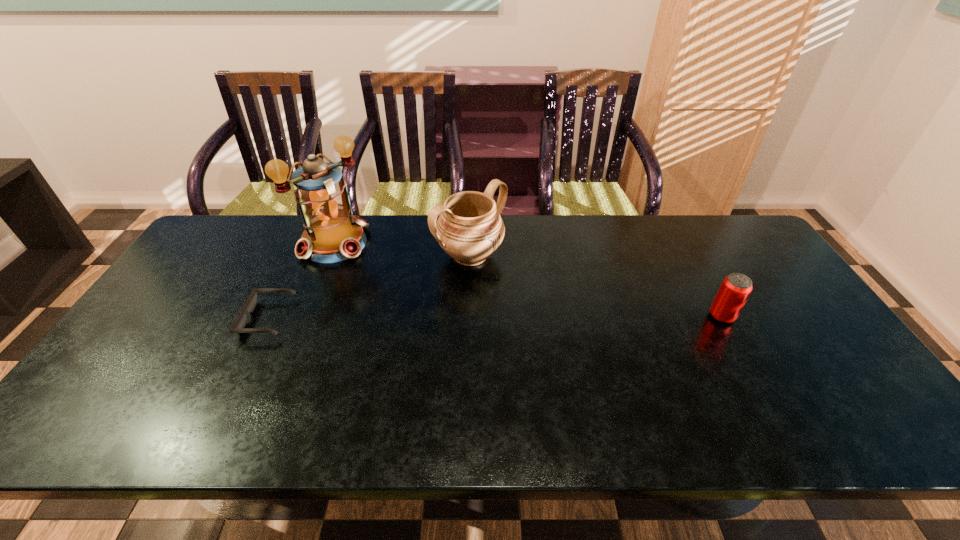
This screenshot has width=960, height=540. Find the location of `free region at the left edge of the desktop`. free region at the left edge of the desktop is located at coordinates (168, 303).

Image resolution: width=960 pixels, height=540 pixels. I want to click on free space at the right edge of the desktop, so click(x=784, y=293).

Locate an element on the screen. This screenshot has height=540, width=960. vacant area between the sunglasses and the lantern is located at coordinates click(x=301, y=281).

Find the location of a particular element. This screenshot has width=960, height=540. free space that is in between the sunglasses and the tallest object is located at coordinates (301, 281).

The image size is (960, 540). What are the coordinates of `vacant space in between the sunglasses and the urn` in the screenshot? It's located at click(x=370, y=287).

This screenshot has height=540, width=960. I want to click on free space between the tallest object and the shortest object, so click(x=301, y=281).

The image size is (960, 540). What are the coordinates of `free space between the second tallest object and the tallest object` in the screenshot? It's located at (402, 249).

At what (x,y) coordinates should I click in order to perform the action: click on free space between the can and the urn. Please return your answer as a coordinate pair (x, y). This screenshot has width=960, height=540. Looking at the image, I should click on (596, 286).

Find the location of a particular element. The height and width of the screenshot is (540, 960). free space between the rightmost object and the third object from left to right is located at coordinates (596, 286).

Identify the location of empty space that is in between the rightmost object and the lantern. (528, 280).